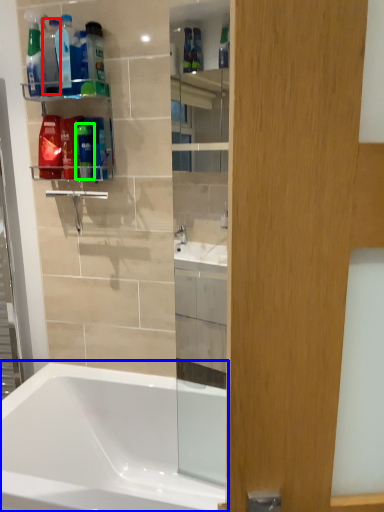
Question: Based on their relative distances, which object is farther from bottle (highlighted by a red box)? Choose from bathtub (highlighted by a blue box) and toiletry (highlighted by a green box).

Choices:
 (A) bathtub
 (B) toiletry

Answer: (A)